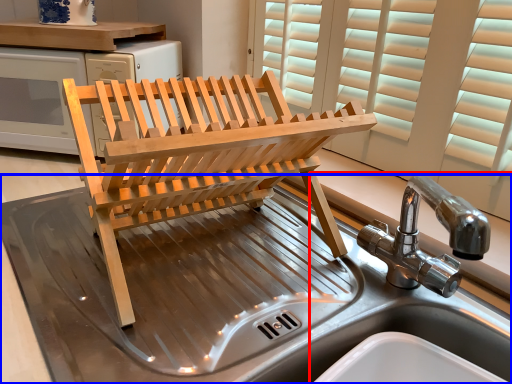
Question: Which object appears closest to the camera in this image, sink (highlighted by a red box) or sink (highlighted by a blue box)?

Choices:
 (A) sink
 (B) sink

Answer: (B)